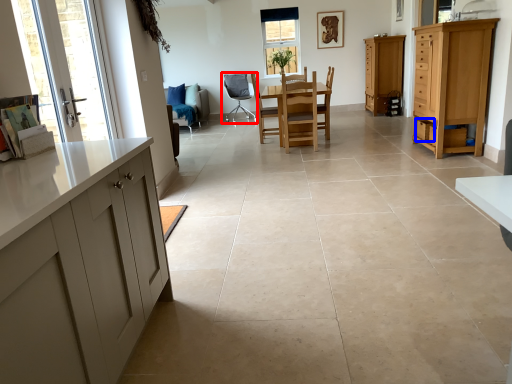
Question: Which of the following is the closest to the observer, chair (highlighted by a red box) or drawer (highlighted by a blue box)?

Choices:
 (A) chair
 (B) drawer

Answer: (B)